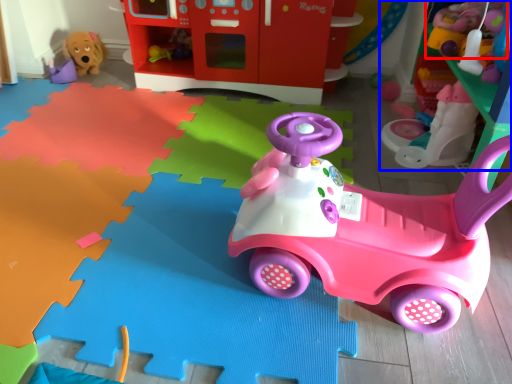
Question: Which object is further to the camera taking this photo, toy (highlighted by a red box) or toy (highlighted by a blue box)?

Choices:
 (A) toy
 (B) toy

Answer: (B)